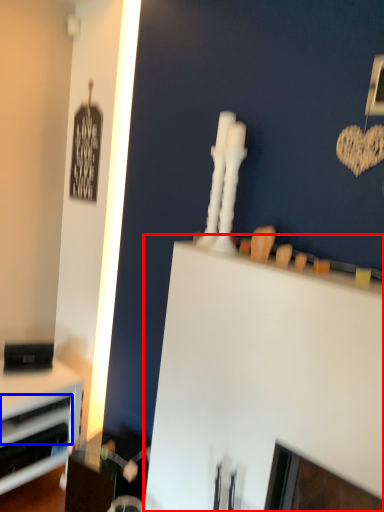
Question: Which of the following is the farthest to the observer, computer desk (highlighted by a red box) or drawer (highlighted by a blue box)?

Choices:
 (A) computer desk
 (B) drawer

Answer: (B)